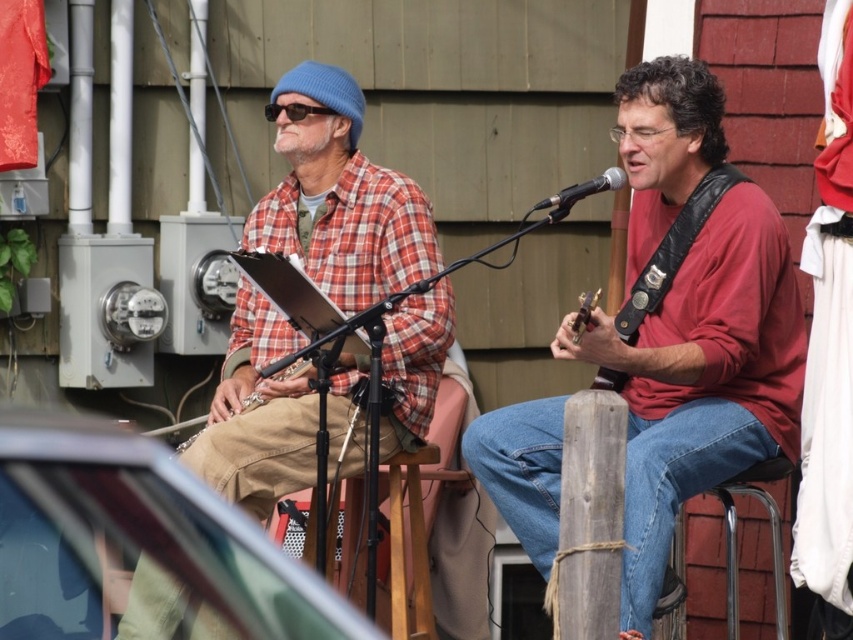
You are setting up a small stage for a performance. There is a wooden stool at center. Where exactly should you place the stool to ensure it aligns with the existing setup shown in the image?

The wooden stool at center should be placed at point (x=422, y=502) to align with the existing setup shown in the image.

You are a stagehand setting up equipment for the performance. You need to place a new amplifier that is 1.2 meters wide. There is space between the wooden stool at center and the black metallic microphone at center. Can the amplifier fit in that space?

The wooden stool at center has a larger size compared to black metallic microphone at center. However, the exact dimensions of the space between them are not provided in the description. Therefore, it is uncertain if the amplifier will fit.